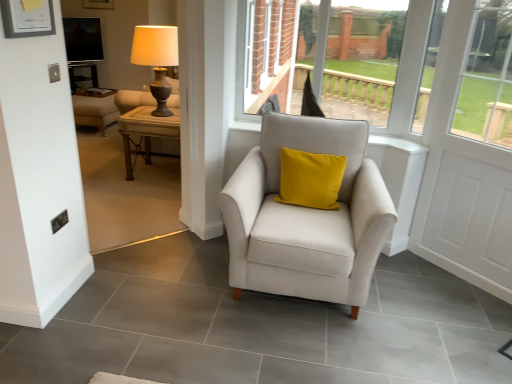
Question: From the image's perspective, relative to satin white armchair at center, is matte wood table at left above or below?

Choices:
 (A) below
 (B) above

Answer: (B)

Question: Considering the positions of point (152, 185) and point (266, 177), is point (152, 185) closer or farther from the camera than point (266, 177)?

Choices:
 (A) farther
 (B) closer

Answer: (A)

Question: Estimate the real-world distances between objects in this image. Which object is farther from the woodenmaterial/texturetable at left?

Choices:
 (A) matte wood table at left
 (B) matte white picture frame at upper left
 (C) white wooden screen door at right
 (D) satin white armchair at center
 (E) matte black screen at upper left

Answer: (E)

Question: Considering the real-world distances, which object is closest to the matte black screen at upper left?

Choices:
 (A) matte wood table at left
 (B) matte gold table lamp at upper left
 (C) woodenmaterial/texturetable at left
 (D) satin white armchair at center
 (E) matte white picture frame at upper left

Answer: (A)